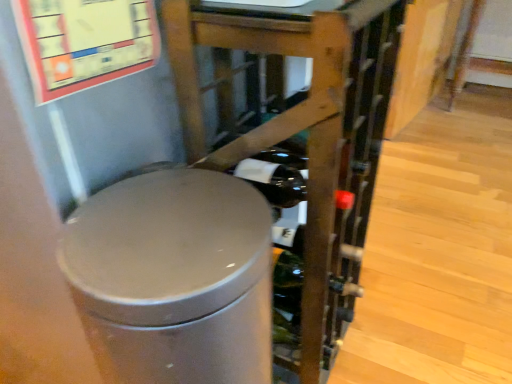
Question: From a real-world perspective, is matte gray trash can at center over satin silver trash can at center?

Choices:
 (A) no
 (B) yes

Answer: (B)

Question: From the image's perspective, would you say matte gray trash can at center is shown under satin silver trash can at center?

Choices:
 (A) yes
 (B) no

Answer: (B)

Question: Is matte gray trash can at center behind satin silver trash can at center?

Choices:
 (A) no
 (B) yes

Answer: (B)

Question: Is matte gray trash can at center at the left side of satin silver trash can at center?

Choices:
 (A) no
 (B) yes

Answer: (A)

Question: Considering the relative sizes of matte gray trash can at center and satin silver trash can at center in the image provided, is matte gray trash can at center wider than satin silver trash can at center?

Choices:
 (A) yes
 (B) no

Answer: (A)

Question: Is matte gray trash can at center completely or partially outside of satin silver trash can at center?

Choices:
 (A) no
 (B) yes

Answer: (B)

Question: Can you confirm if satin silver trash can at center is taller than matte gray trash can at center?

Choices:
 (A) no
 (B) yes

Answer: (A)

Question: Is satin silver trash can at center to the left of matte gray trash can at center from the viewer's perspective?

Choices:
 (A) yes
 (B) no

Answer: (A)

Question: Can you confirm if satin silver trash can at center is positioned to the right of matte gray trash can at center?

Choices:
 (A) no
 (B) yes

Answer: (A)

Question: From a real-world perspective, is satin silver trash can at center physically above matte gray trash can at center?

Choices:
 (A) no
 (B) yes

Answer: (A)

Question: Would you consider satin silver trash can at center to be distant from matte gray trash can at center?

Choices:
 (A) no
 (B) yes

Answer: (A)

Question: From the image's perspective, is satin silver trash can at center above matte gray trash can at center?

Choices:
 (A) yes
 (B) no

Answer: (B)

Question: Based on their sizes in the image, would you say satin silver trash can at center is bigger or smaller than matte gray trash can at center?

Choices:
 (A) big
 (B) small

Answer: (B)